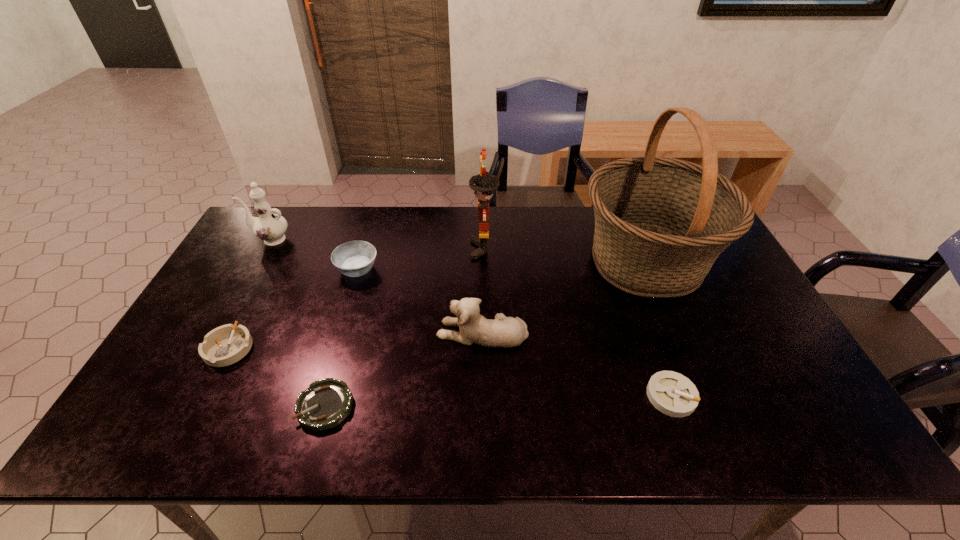
In order to click on basket located in the far edge section of the desktop in this screenshot , I will do [660, 223].

This screenshot has height=540, width=960. Find the location of `nutcracker that is at the far edge`. nutcracker that is at the far edge is located at coordinates (483, 184).

This screenshot has height=540, width=960. Find the location of `chinaware present at the far edge`. chinaware present at the far edge is located at coordinates (269, 227).

Locate an element on the screen. The width and height of the screenshot is (960, 540). chinaware that is at the left edge is located at coordinates (269, 227).

At what (x,y) coordinates should I click in order to perform the action: click on ashtray positioned at the left edge. Please return your answer as a coordinate pair (x, y). The width and height of the screenshot is (960, 540). Looking at the image, I should click on (225, 345).

This screenshot has width=960, height=540. I want to click on object present at the right edge, so click(660, 223).

Where is `object located in the far left corner section of the desktop`? object located in the far left corner section of the desktop is located at coordinates (269, 227).

Locate an element on the screen. The height and width of the screenshot is (540, 960). object that is at the far right corner is located at coordinates (660, 223).

Where is `free space at the far edge`? This screenshot has height=540, width=960. free space at the far edge is located at coordinates (478, 209).

This screenshot has width=960, height=540. Find the location of `free space at the near edge of the desktop`. free space at the near edge of the desktop is located at coordinates (685, 434).